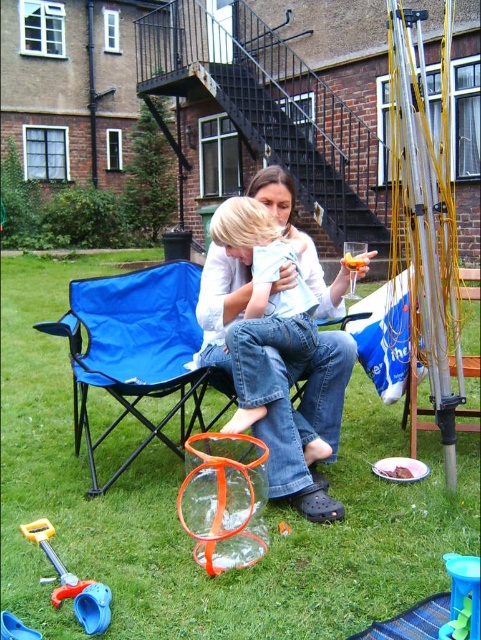
Is green grass at lower center shorter than blue plastic toy at lower left?

Indeed, green grass at lower center has a lesser height compared to blue plastic toy at lower left.

This screenshot has width=481, height=640. What are the coordinates of `green grass at lower center` in the screenshot? It's located at (176, 515).

Does blue plastic toy at lower left have a lesser width compared to brown crumbly cake at lower center?

No.

Which is above, blue plastic toy at lower left or brown crumbly cake at lower center?

brown crumbly cake at lower center is higher up.

Find the location of a particular element. The height and width of the screenshot is (640, 481). blue plastic toy at lower left is located at coordinates (73, 582).

Does blue fabric chair at left have a greater width compared to blue plastic toy at lower left?

Indeed, blue fabric chair at left has a greater width compared to blue plastic toy at lower left.

You are a GUI agent. You are given a task and a screenshot of the screen. Output one action in this format:
    pyautogui.click(x=<x>, y=<y>)
    Task: Click on the blue fabric chair at left
    
    Given the screenshot: What is the action you would take?
    pyautogui.click(x=135, y=349)

At what (x,y) coordinates should I click in order to perform the action: click on blue fabric chair at left. Please return your answer as a coordinate pair (x, y). The image size is (481, 640). Looking at the image, I should click on (135, 349).